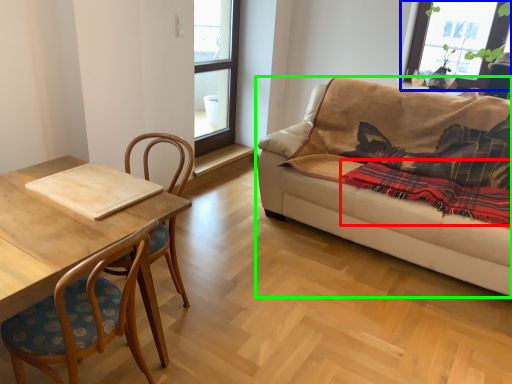
Question: Considering the real-world distances, which object is farthest from blanket (highlighted by a red box)? window (highlighted by a blue box) or studio couch (highlighted by a green box)?

Choices:
 (A) window
 (B) studio couch

Answer: (A)